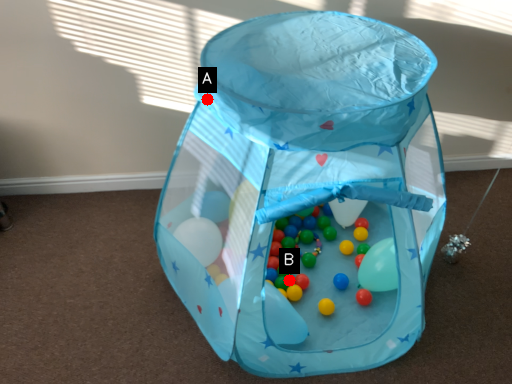
Question: Two points are circled on the image, labeled by A and B beside each circle. Among these points, which one is nearest to the camera?

Choices:
 (A) A is closer
 (B) B is closer

Answer: (A)